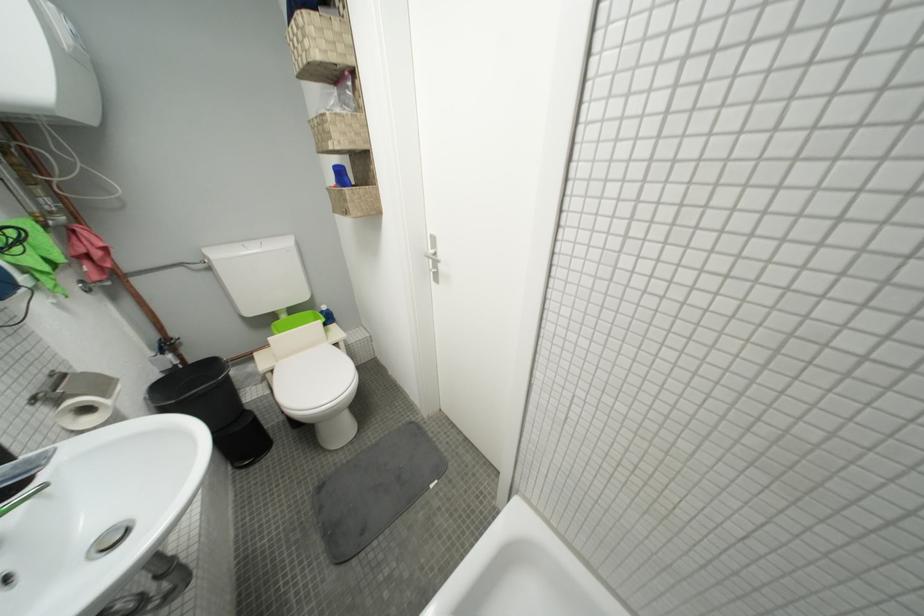
Locate an element on the screen. This screenshot has height=616, width=924. blue plastic bottle is located at coordinates (341, 176).